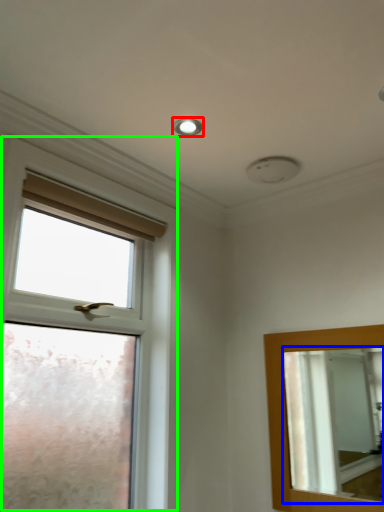
Question: Considering the real-world distances, which object is closest to droplight (highlighted by a red box)? mirror (highlighted by a blue box) or window (highlighted by a green box).

Choices:
 (A) mirror
 (B) window

Answer: (B)